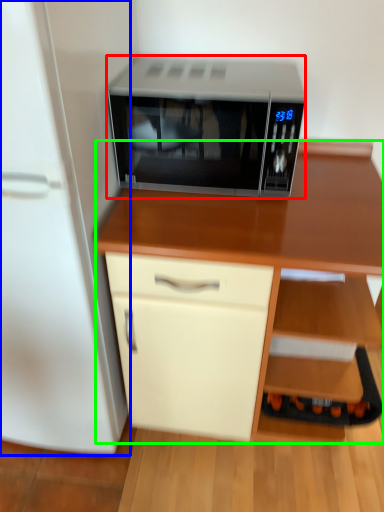
Question: Considering the real-world distances, which object is closest to microwave oven (highlighted by a red box)? refrigerator (highlighted by a blue box) or desk (highlighted by a green box).

Choices:
 (A) refrigerator
 (B) desk

Answer: (B)